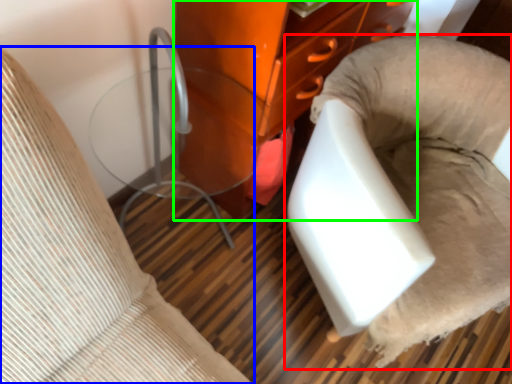
Question: Considering the real-world distances, which object is farthest from furniture (highlighted by a red box)? furniture (highlighted by a blue box) or furniture (highlighted by a green box)?

Choices:
 (A) furniture
 (B) furniture

Answer: (A)